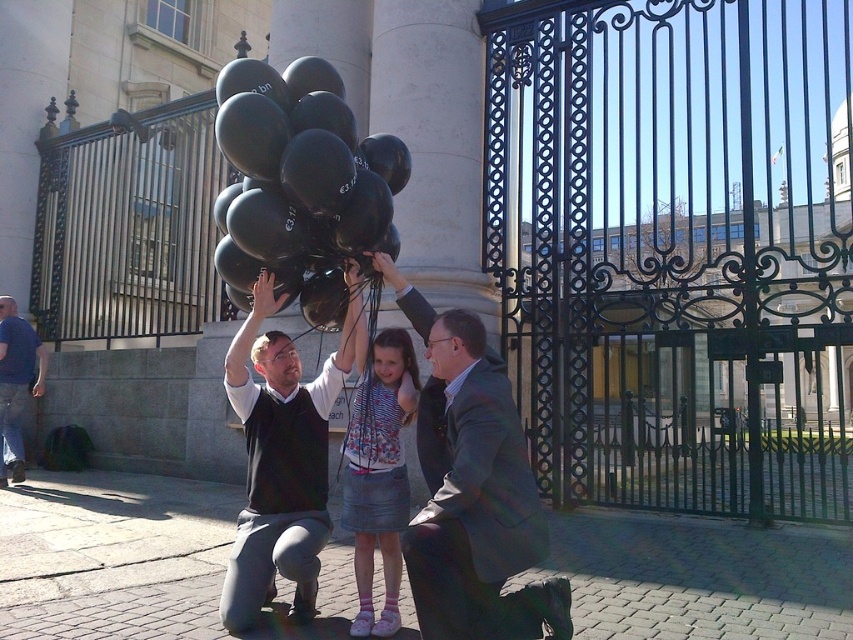
From the picture: You are standing at the center of the image. Which direction should you move to reach the blue denim jeans at left?

Since the blue denim jeans at left is located at point (16, 384), which is on the left side of the image, you should move to the left to reach it.

Consider the image. You are a photographer standing in front of the ornate metal gates. You want to take a photo of the black matte balloons at center and the smooth gray suit at center so that the balloons appear to the right of the suit in the photo. Is this possible given their current positions?

The black matte balloons at center are currently to the left of the smooth gray suit at center. To make the balloons appear to the right of the suit in the photo, you would need to adjust your position or the subjects, as their current spatial arrangement does not allow the balloons to be on the right side of the suit in the frame.

You are a photographer at the scene and want to capture a photo where the denim skirt at center and the blue denim jeans at left are both visible. Based on their positions, which clothing item is positioned higher in the image?

The denim skirt at center is positioned higher than the blue denim jeans at left, so it will appear higher in the photo.